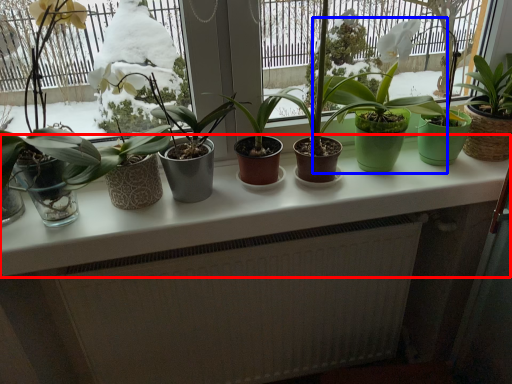
Question: Which object appears closest to the camera in this image, counter top (highlighted by a red box) or houseplant (highlighted by a blue box)?

Choices:
 (A) counter top
 (B) houseplant

Answer: (A)